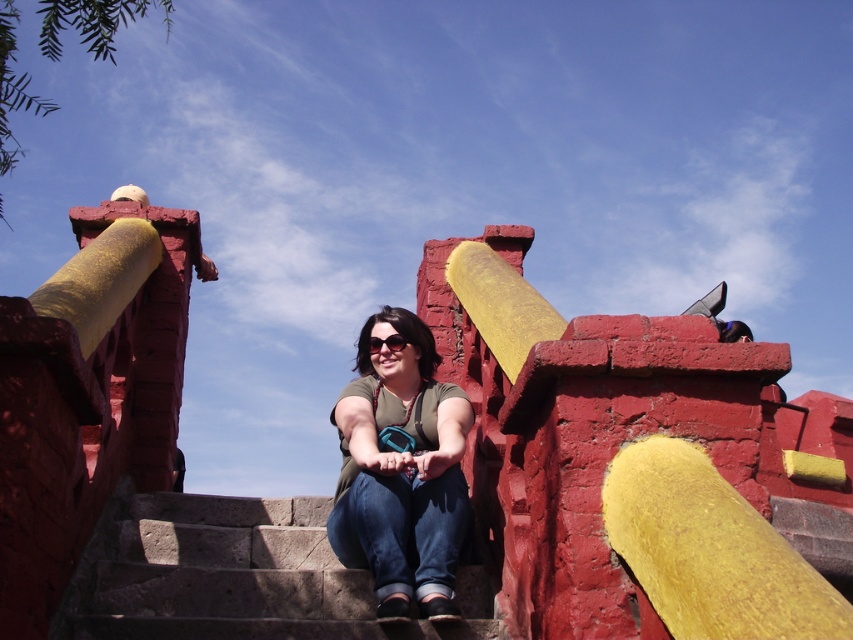
Question: Can you confirm if concrete stairs at center is wider than matte green shirt at center?

Choices:
 (A) yes
 (B) no

Answer: (A)

Question: Which of these objects is positioned closest to the concrete stairs at center?

Choices:
 (A) blue plastic goggles at center
 (B) matte green shirt at center

Answer: (B)

Question: Which point is closer to the camera?

Choices:
 (A) (373, 337)
 (B) (349, 504)

Answer: (B)

Question: Which point appears farthest from the camera in this image?

Choices:
 (A) (367, 346)
 (B) (399, 538)

Answer: (A)

Question: Can you confirm if matte green shirt at center is bigger than blue plastic goggles at center?

Choices:
 (A) yes
 (B) no

Answer: (A)

Question: Does concrete stairs at center have a lesser width compared to matte green shirt at center?

Choices:
 (A) no
 (B) yes

Answer: (A)